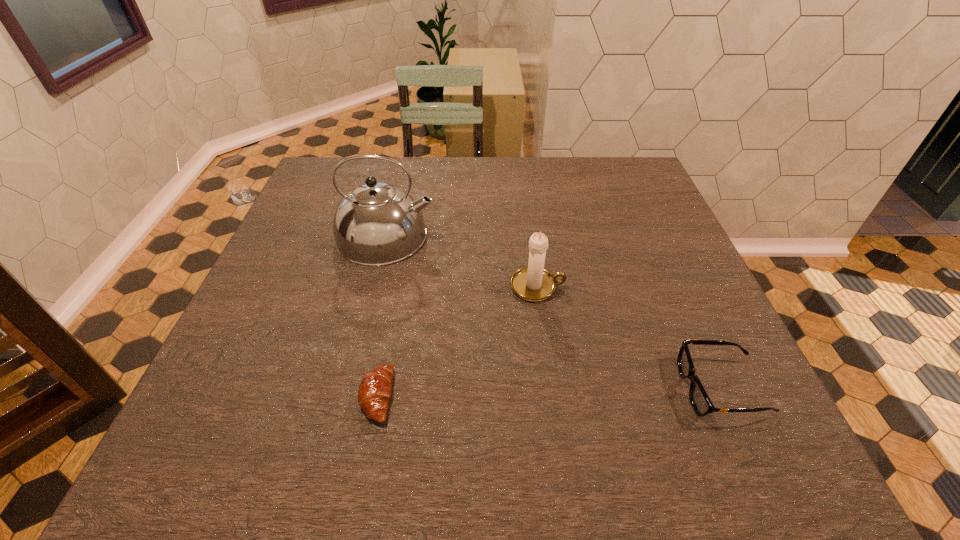
You are a GUI agent. You are given a task and a screenshot of the screen. Output one action in this format:
    pyautogui.click(x=<x>, y=<y>)
    Task: Click on the object that ranks as the closest to the kettle
    The image size is (960, 540).
    Given the screenshot: What is the action you would take?
    (x=533, y=283)

Choose which object is the third nearest neighbor to the second object from right to left. Please provide its 2D coordinates. Your answer should be formatted as a tuple, i.e. [(x, y)], where the tuple contains the x and y coordinates of a point satisfying the conditions above.

[(375, 389)]

You are a GUI agent. You are given a task and a screenshot of the screen. Output one action in this format:
    pyautogui.click(x=<x>, y=<y>)
    Task: Click on the vacant area in the image that satisfies the following two spatial constraints: 1. from the spout of the shortest object; 2. on the left side of the tallest object
    This screenshot has width=960, height=540.
    Given the screenshot: What is the action you would take?
    pyautogui.click(x=348, y=396)

The width and height of the screenshot is (960, 540). Identify the location of free spot that satisfies the following two spatial constraints: 1. from the spout of the kettle; 2. on the back side of the shortest object. (348, 396).

Identify the location of free space that satisfies the following two spatial constraints: 1. on the front-facing side of the third tallest object; 2. on the front side of the crescent roll. (724, 396).